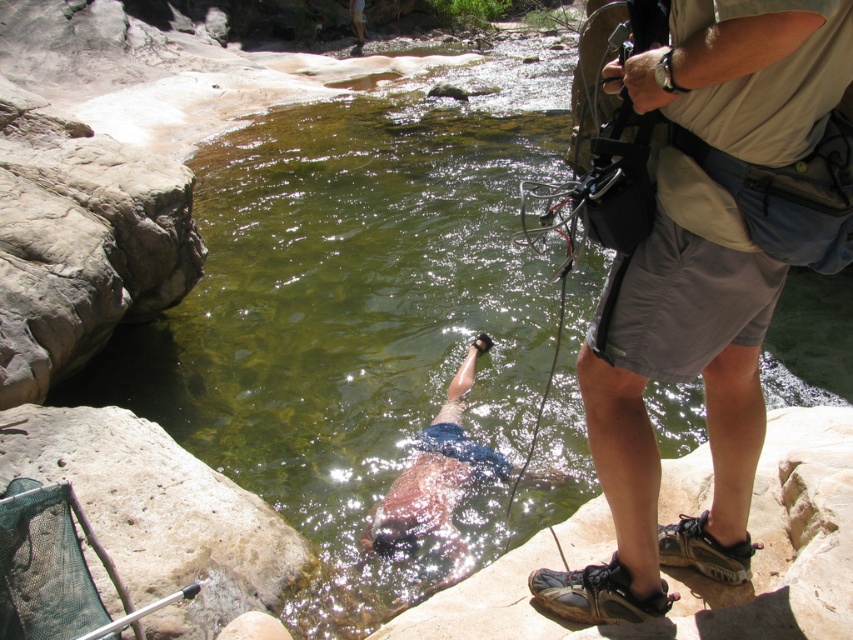
Question: Estimate the real-world distances between objects in this image. Which object is closer to the brown rock at lower center?

Choices:
 (A) tan fabric shirt at upper right
 (B) smooth beige rock at lower left

Answer: (A)

Question: Which point is farther from the camera taking this photo?

Choices:
 (A) click(x=787, y=92)
 (B) click(x=595, y=518)

Answer: (B)

Question: Does brown rock at lower center have a greater width compared to smooth beige rock at lower left?

Choices:
 (A) no
 (B) yes

Answer: (B)

Question: Does tan fabric shirt at upper right have a greater width compared to smooth beige rock at lower left?

Choices:
 (A) yes
 (B) no

Answer: (B)

Question: Which object appears farthest from the camera in this image?

Choices:
 (A) tan fabric shirt at upper right
 (B) brown rock at lower center

Answer: (B)

Question: Does brown rock at lower center have a lesser width compared to smooth beige rock at lower left?

Choices:
 (A) yes
 (B) no

Answer: (B)